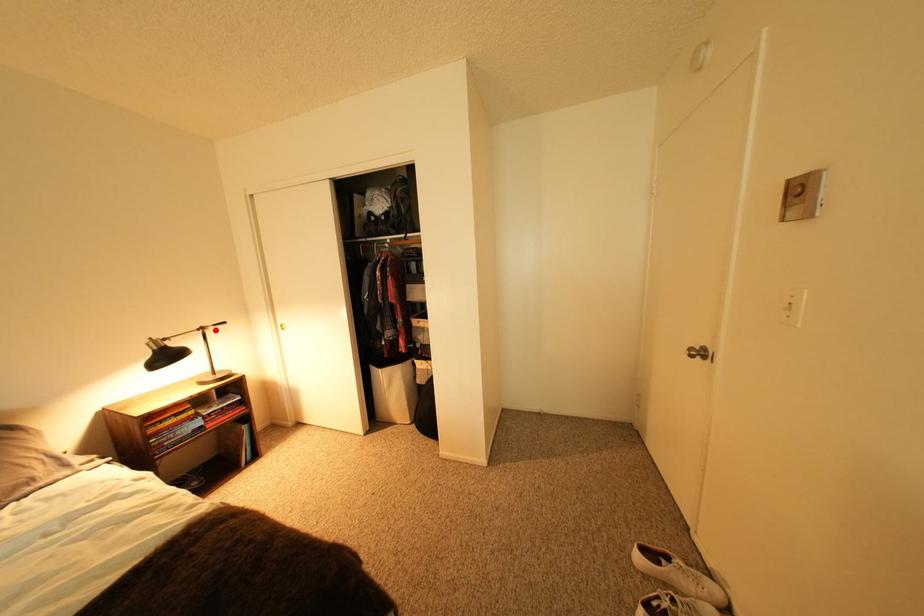
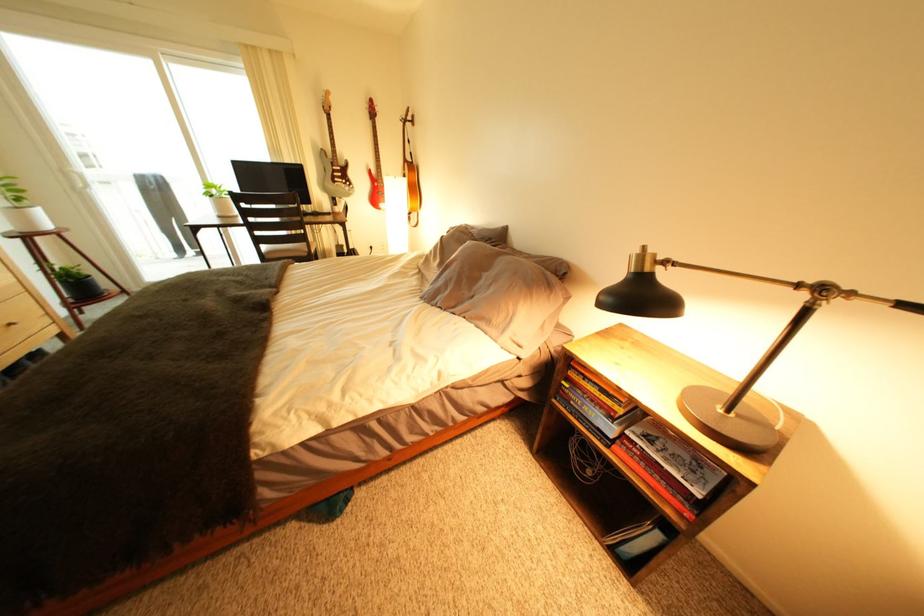
In the second image, find the point that corresponds to the highlighted location in the first image.

(834, 291)